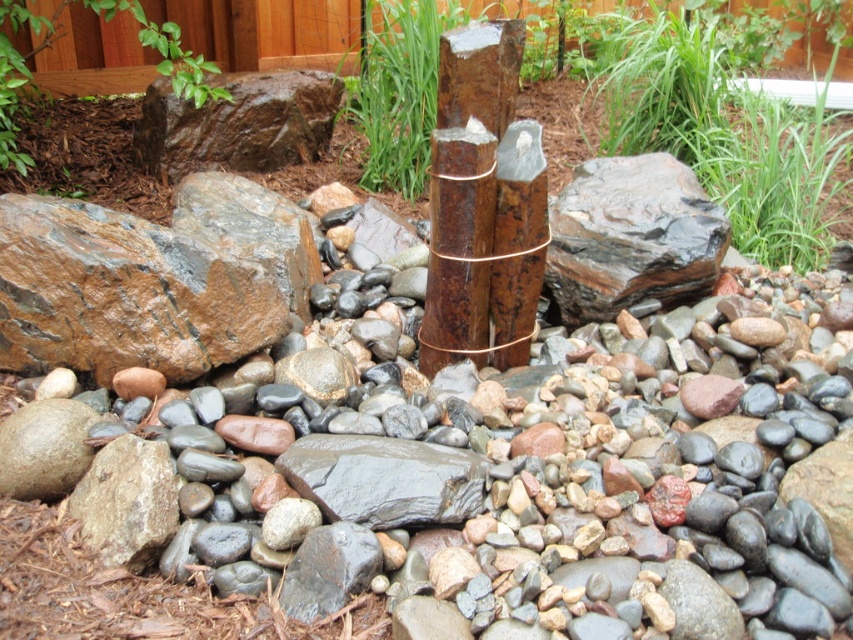
Question: Does shiny black rock at center-right have a larger size compared to shiny gray rock at center?

Choices:
 (A) no
 (B) yes

Answer: (B)

Question: Can you confirm if shiny black rock at center-right is bigger than shiny gray rock at center?

Choices:
 (A) no
 (B) yes

Answer: (B)

Question: Is shiny black rock at center-right wider than shiny gray rock at center?

Choices:
 (A) yes
 (B) no

Answer: (A)

Question: Which object is farther from the camera taking this photo?

Choices:
 (A) shiny gray rock at center
 (B) shiny black rock at center-right

Answer: (B)

Question: Which of the following is the farthest from the observer?

Choices:
 (A) shiny black rock at center-right
 (B) shiny gray rock at center

Answer: (A)

Question: Which object is farther from the camera taking this photo?

Choices:
 (A) shiny black rock at center-right
 (B) shiny gray rock at center

Answer: (A)